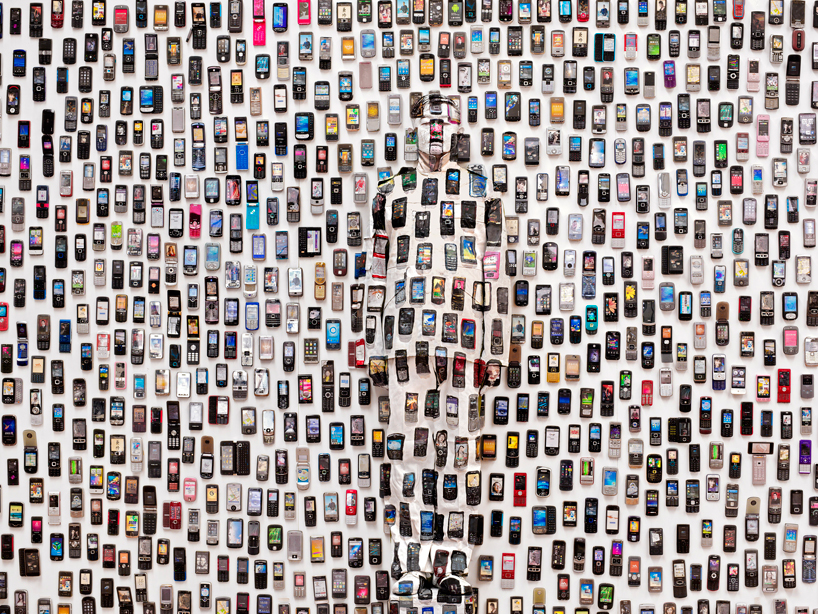
Find the location of a particular element. phone is located at coordinates (473, 488).